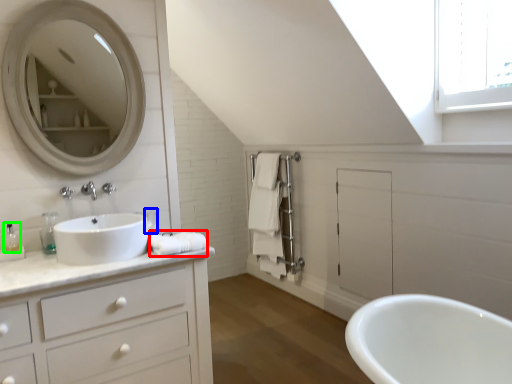
Question: Considering the real-world distances, which object is farthest from bath towel (highlighted by a red box)? toiletry (highlighted by a blue box) or toiletry (highlighted by a green box)?

Choices:
 (A) toiletry
 (B) toiletry

Answer: (B)